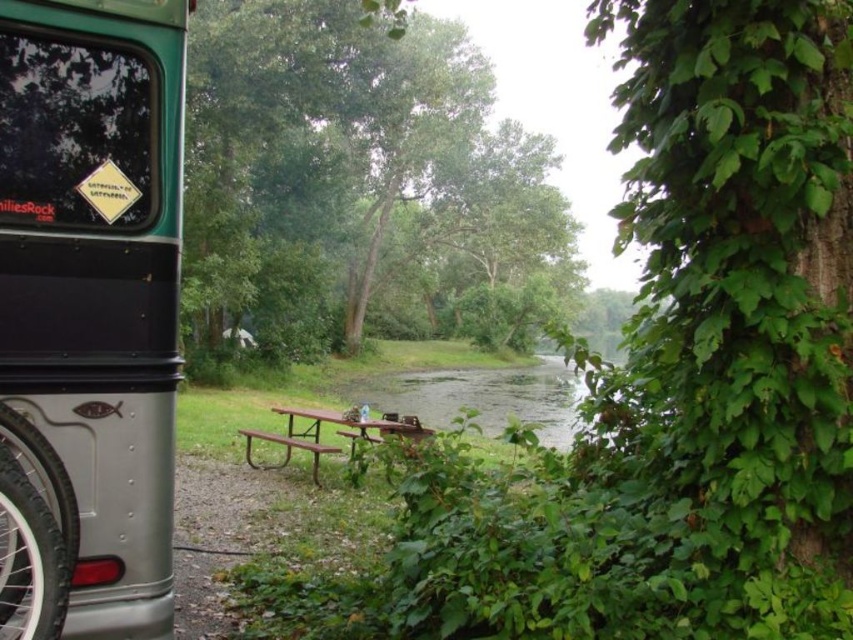
You are planning to take a photo of the metallic silver recreational vehicle at left and the green leafy tree at center. Which object should you focus on first if you want to capture both in a single frame without zooming in or out?

The metallic silver recreational vehicle at left should be focused on first because it is smaller in size compared to the green leafy tree at center. By focusing on the smaller object first, you can ensure that both objects fit within the frame without needing to adjust the zoom.

You are planning to set up a tent for a picnic and need to choose between the area near the green leafy tree at center or the brown metal picnic table at center. Which location offers more space for your tent?

The brown metal picnic table at center offers more space for your tent because the green leafy tree at center is larger in size than the picnic table, meaning the area around the picnic table is more open.

You are standing at the picnic table in the center of the image. You want to take a photo of the green leafy tree at center. Which direction should you face to capture it in your camera?

Since the green leafy tree at center is located at point 0.263 on the x and 0.417 on the y coordinates, you should face towards the center of the image to capture it in your camera.